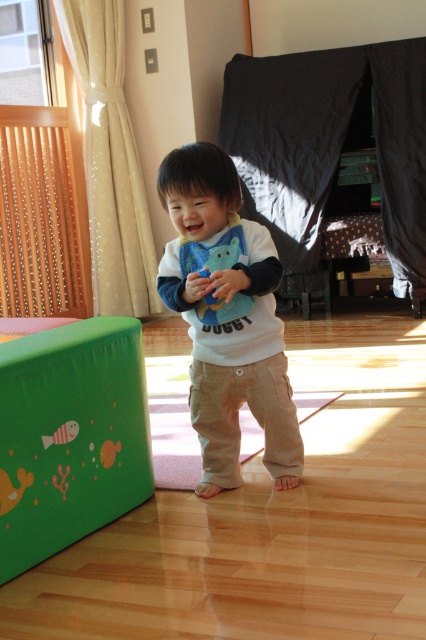
The child is holding a small object in their hands. Which object is positioned lower in the scene, the green rubber play cube at lower left or the matte white shirt at center?

The green rubber play cube at lower left is located below the matte white shirt at center, so the green rubber play cube at lower left is positioned lower in the scene.

The child is holding a toy in their hands. Which object is closer to the child, the green rubber play cube at lower left or the matte white shirt at center?

The green rubber play cube at lower left is closer to the child because it is positioned on the left side of the matte white shirt at center.